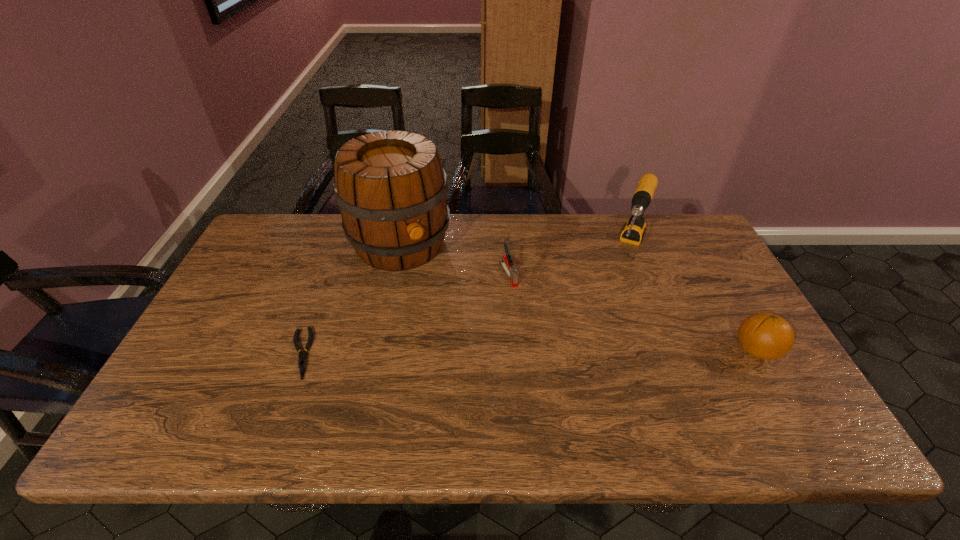
The height and width of the screenshot is (540, 960). In order to click on vacant space positioned on the handle side of the third object from left to right in this screenshot , I will do `click(529, 315)`.

Find the location of a particular element. The image size is (960, 540). vacant space located 0.140m on the handle side of the fourth shortest object is located at coordinates (617, 306).

The width and height of the screenshot is (960, 540). I want to click on free space located on the handle side of the fourth shortest object, so click(x=623, y=293).

Where is `vacant area located 0.270m on the handle side of the fourth shortest object`? vacant area located 0.270m on the handle side of the fourth shortest object is located at coordinates (606, 339).

The image size is (960, 540). I want to click on vacant region located 0.380m on the side of the cider where the spigot is located, so click(478, 368).

You are a GUI agent. You are given a task and a screenshot of the screen. Output one action in this format:
    pyautogui.click(x=<x>, y=<y>)
    Task: Click on the vacant space located on the side of the cider where the spigot is located
    The height and width of the screenshot is (540, 960).
    Given the screenshot: What is the action you would take?
    pyautogui.click(x=442, y=309)

This screenshot has width=960, height=540. I want to click on vacant area situated on the side of the cider where the spigot is located, so click(442, 309).

Locate an element on the screen. drill at the far edge is located at coordinates (634, 229).

Identify the location of cider that is at the far edge. (391, 189).

Where is `object at the near edge`? This screenshot has height=540, width=960. object at the near edge is located at coordinates (302, 362).